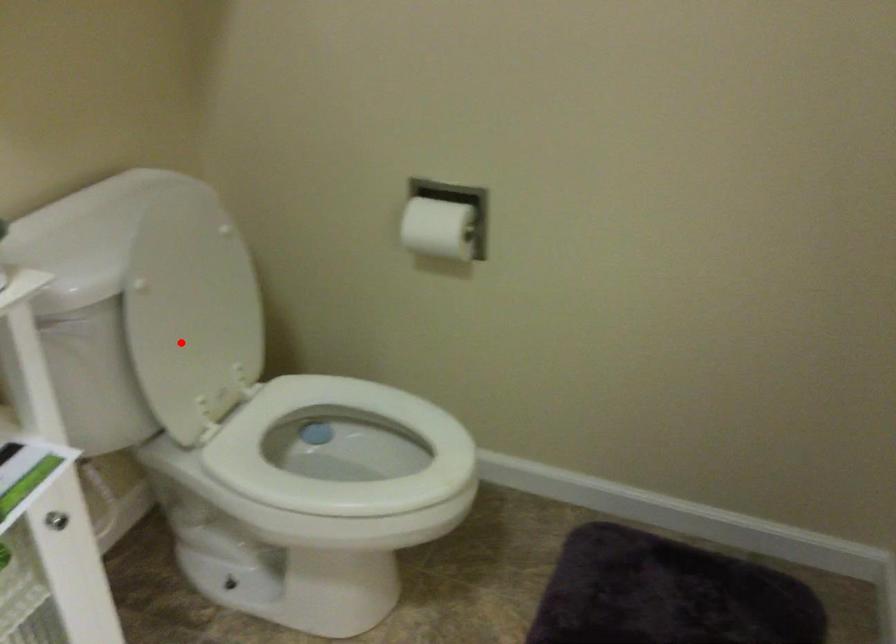
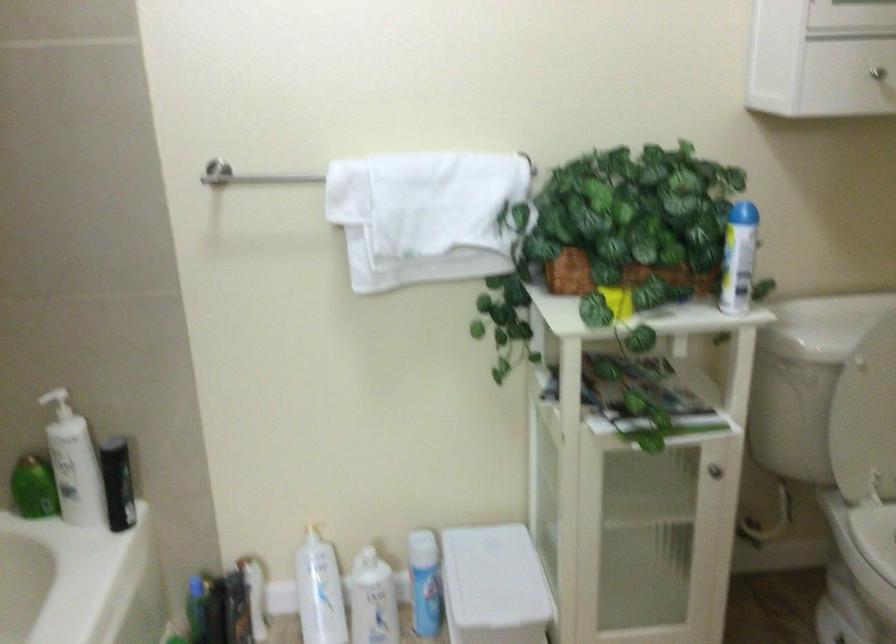
Question: I am providing you with two images of the same scene from different viewpoints. A red point is shown in image1. For the corresponding object point in image2, is it positioned nearer or farther from the camera?

Choices:
 (A) Nearer
 (B) Farther

Answer: (B)